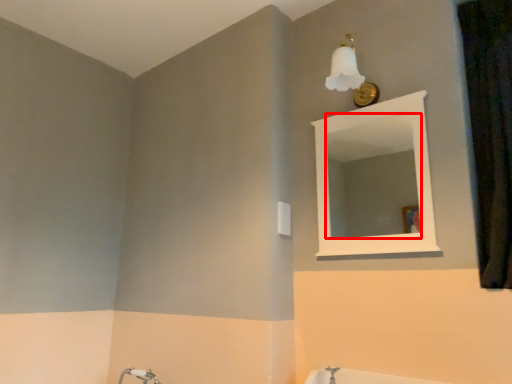
Question: From the image's perspective, what is the correct spatial positioning of mirror (annotated by the red box) in reference to curtain?

Choices:
 (A) below
 (B) above

Answer: (A)